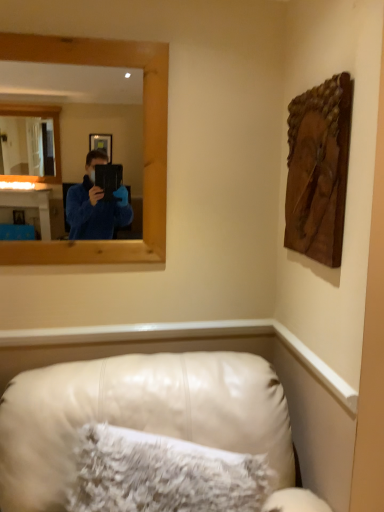
Question: Can you confirm if wooden frame at upper left is shorter than wooden carving at upper right?

Choices:
 (A) yes
 (B) no

Answer: (B)

Question: Considering the relative positions of wooden frame at upper left and wooden carving at upper right in the image provided, is wooden frame at upper left in front of wooden carving at upper right?

Choices:
 (A) yes
 (B) no

Answer: (B)

Question: Would you say wooden carving at upper right is part of wooden frame at upper left's contents?

Choices:
 (A) no
 (B) yes

Answer: (A)

Question: Is wooden frame at upper left oriented away from wooden carving at upper right?

Choices:
 (A) no
 (B) yes

Answer: (A)

Question: Considering the relative sizes of wooden frame at upper left and wooden carving at upper right in the image provided, is wooden frame at upper left wider than wooden carving at upper right?

Choices:
 (A) no
 (B) yes

Answer: (B)

Question: From a real-world perspective, is leather couch at lower center above or below wooden frame at upper left?

Choices:
 (A) above
 (B) below

Answer: (B)

Question: Is leather couch at lower center spatially inside wooden frame at upper left, or outside of it?

Choices:
 (A) inside
 (B) outside

Answer: (B)

Question: Looking at the image, does leather couch at lower center seem bigger or smaller compared to wooden frame at upper left?

Choices:
 (A) small
 (B) big

Answer: (B)

Question: From the image's perspective, is leather couch at lower center positioned above or below wooden frame at upper left?

Choices:
 (A) below
 (B) above

Answer: (A)

Question: Does point (321, 150) appear closer or farther from the camera than point (117, 482)?

Choices:
 (A) closer
 (B) farther

Answer: (B)

Question: From a real-world perspective, relative to white fluffy pillow at lower center, is wooden carving at upper right vertically above or below?

Choices:
 (A) above
 (B) below

Answer: (A)

Question: From the image's perspective, is wooden carving at upper right above or below white fluffy pillow at lower center?

Choices:
 (A) above
 (B) below

Answer: (A)

Question: Based on their sizes in the image, would you say wooden carving at upper right is bigger or smaller than white fluffy pillow at lower center?

Choices:
 (A) big
 (B) small

Answer: (B)

Question: Is leather couch at lower center inside or outside of wooden carving at upper right?

Choices:
 (A) inside
 (B) outside

Answer: (B)

Question: In terms of size, does leather couch at lower center appear bigger or smaller than wooden carving at upper right?

Choices:
 (A) small
 (B) big

Answer: (B)